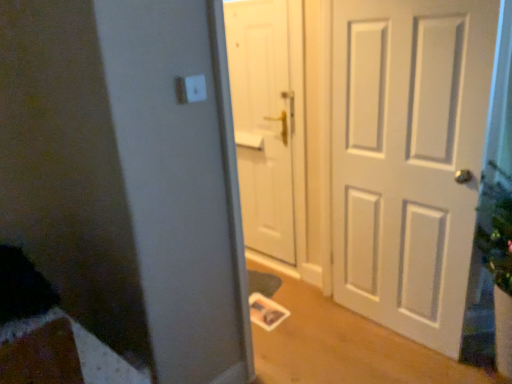
Question: Considering the positions of white matte door at center, which is the 1th door in left-to-right order, and white plastic light switch at upper center in the image, is white matte door at center, which is the 1th door in left-to-right order, wider or thinner than white plastic light switch at upper center?

Choices:
 (A) thin
 (B) wide

Answer: (B)

Question: Is white matte door at center, which is the 1th door in left-to-right order, spatially inside white plastic light switch at upper center, or outside of it?

Choices:
 (A) inside
 (B) outside

Answer: (B)

Question: Which of these objects is positioned farthest from the white matte door at center, which is the 1th door in left-to-right order?

Choices:
 (A) white plastic light switch at upper center
 (B) white matte door at right, the 2th door from the left

Answer: (A)

Question: Which of these objects is positioned farthest from the white plastic light switch at upper center?

Choices:
 (A) white matte door at center, the 2th door from the right
 (B) white matte door at right, the first door positioned from the right

Answer: (A)